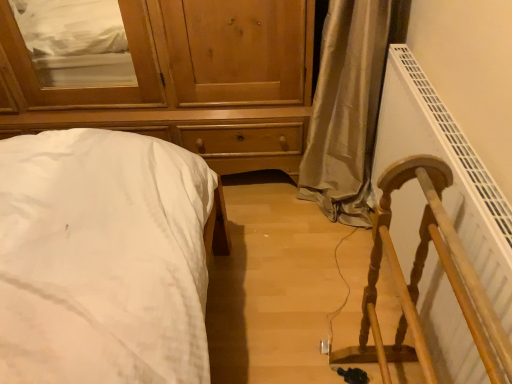
What is the approximate height of white plastic radiator at right?

The height of white plastic radiator at right is 67.33 centimeters.

In order to click on wooden chest of drawers at upper left in this screenshot , I will do `click(181, 81)`.

What do you see at coordinates (102, 259) in the screenshot? The width and height of the screenshot is (512, 384). I see `white cotton bed at left` at bounding box center [102, 259].

You are a GUI agent. You are given a task and a screenshot of the screen. Output one action in this format:
    pyautogui.click(x=<x>, y=<y>)
    Task: Click on the white plastic radiator at right
    The image size is (512, 384).
    Given the screenshot: What is the action you would take?
    tap(446, 161)

Considering the relative positions of wooden chest of drawers at upper left and white plastic radiator at right in the image provided, is wooden chest of drawers at upper left to the left of white plastic radiator at right from the viewer's perspective?

Yes.

Can you confirm if wooden chest of drawers at upper left is smaller than white plastic radiator at right?

Actually, wooden chest of drawers at upper left might be larger than white plastic radiator at right.

How much distance is there between wooden chest of drawers at upper left and white plastic radiator at right?

wooden chest of drawers at upper left and white plastic radiator at right are 28.13 inches apart from each other.

Is the position of wooden chest of drawers at upper left more distant than that of white plastic radiator at right?

That is True.

From the image's perspective, is white plastic radiator at right under wooden chest of drawers at upper left?

Yes, from the image's perspective, white plastic radiator at right is below wooden chest of drawers at upper left.

Can we say white plastic radiator at right lies outside wooden chest of drawers at upper left?

Yes, white plastic radiator at right is outside of wooden chest of drawers at upper left.

Is white plastic radiator at right smaller than wooden chest of drawers at upper left?

Yes.

Measure the distance from wooden chest of drawers at upper left to white cotton bed at left.

wooden chest of drawers at upper left and white cotton bed at left are 26.81 inches apart.

Does wooden chest of drawers at upper left have a smaller size compared to white cotton bed at left?

Actually, wooden chest of drawers at upper left might be larger than white cotton bed at left.

Based on the photo, who is shorter, wooden chest of drawers at upper left or white cotton bed at left?

With less height is white cotton bed at left.

Is wooden chest of drawers at upper left at the right side of white cotton bed at left?

No, wooden chest of drawers at upper left is not to the right of white cotton bed at left.

Considering the sizes of white cotton bed at left and wooden chest of drawers at upper left in the image, is white cotton bed at left wider or thinner than wooden chest of drawers at upper left?

Clearly, white cotton bed at left has more width compared to wooden chest of drawers at upper left.

Where is `bed in front of the wooden chest of drawers at upper left`? bed in front of the wooden chest of drawers at upper left is located at coordinates (102, 259).

Are white cotton bed at left and wooden chest of drawers at upper left located far from each other?

No, white cotton bed at left is not far from wooden chest of drawers at upper left.

Does point (113, 275) lie behind point (130, 96)?

No, it is in front of (130, 96).

How many degrees apart are the facing directions of white plastic radiator at right and white cotton bed at left?

white plastic radiator at right and white cotton bed at left are facing 87.4 degrees away from each other.

Does white plastic radiator at right contain white cotton bed at left?

No, white plastic radiator at right does not contain white cotton bed at left.

Which point is more distant from viewer, (455, 156) or (122, 272)?

The point (455, 156) is farther from the camera.

Are white plastic radiator at right and white cotton bed at left beside each other?

No, white plastic radiator at right is not with white cotton bed at left.

From a real-world perspective, who is located lower, white cotton bed at left or white plastic radiator at right?

white cotton bed at left.

From the image's perspective, which one is positioned higher, white cotton bed at left or white plastic radiator at right?

white plastic radiator at right appears higher in the image.

Is white cotton bed at left inside or outside of white plastic radiator at right?

The correct answer is: outside.

Is white cotton bed at left beside white plastic radiator at right?

white cotton bed at left and white plastic radiator at right are not in contact.

Find the location of a particular element. chest of drawers that is on the left side of white plastic radiator at right is located at coordinates (181, 81).

Locate an element on the screen. radiator that appears in front of the wooden chest of drawers at upper left is located at coordinates (446, 161).

Based on their spatial positions, is wooden chest of drawers at upper left or white cotton bed at left closer to white plastic radiator at right?

wooden chest of drawers at upper left lies closer to white plastic radiator at right than the other object.

Based on their spatial positions, is white plastic radiator at right or wooden chest of drawers at upper left closer to white cotton bed at left?

wooden chest of drawers at upper left.

Based on their spatial positions, is white cotton bed at left or wooden chest of drawers at upper left closer to white plastic radiator at right?

Among the two, wooden chest of drawers at upper left is located nearer to white plastic radiator at right.

Looking at the image, which one is located further to wooden chest of drawers at upper left, white plastic radiator at right or white cotton bed at left?

white plastic radiator at right.

Looking at the image, which one is located further to white cotton bed at left, wooden chest of drawers at upper left or white plastic radiator at right?

white plastic radiator at right lies further to white cotton bed at left than the other object.

From the image, which object appears to be nearer to wooden chest of drawers at upper left, white cotton bed at left or white plastic radiator at right?

Among the two, white cotton bed at left is located nearer to wooden chest of drawers at upper left.

Where is `bed between wooden chest of drawers at upper left and white plastic radiator at right in the horizontal direction`? The image size is (512, 384). bed between wooden chest of drawers at upper left and white plastic radiator at right in the horizontal direction is located at coordinates (102, 259).